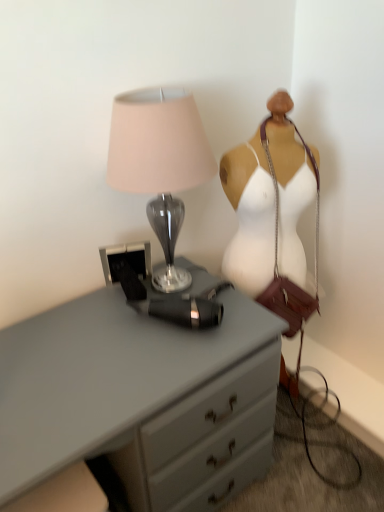
Question: Based on their sizes in the image, would you say white fabric mannequin at right is bigger or smaller than satin gray lamp at upper left?

Choices:
 (A) big
 (B) small

Answer: (A)

Question: Choose the correct answer: Is white fabric mannequin at right inside satin gray lamp at upper left or outside it?

Choices:
 (A) inside
 (B) outside

Answer: (B)

Question: Estimate the real-world distances between objects in this image. Which object is closer to the satin gray lamp at upper left?

Choices:
 (A) matte gray chest of drawers at center
 (B) white fabric mannequin at right

Answer: (B)

Question: Which object is the farthest from the matte gray chest of drawers at center?

Choices:
 (A) satin gray lamp at upper left
 (B) white fabric mannequin at right

Answer: (B)